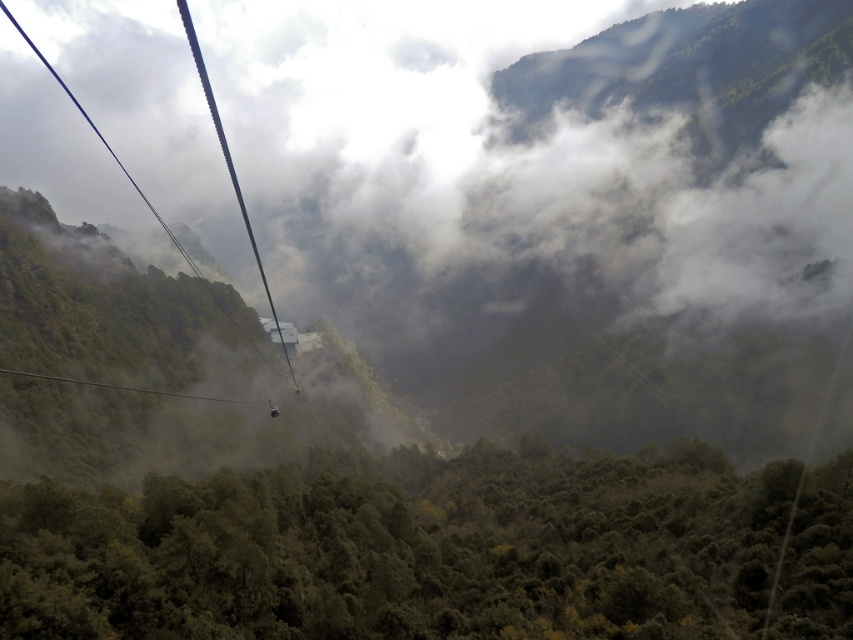
You are riding a cable car and see the white fluffy fog at center and the white plastic ski lift at left. Which object is higher in the scene?

The white fluffy fog at center is much taller than the white plastic ski lift at left, so the white fluffy fog at center is higher in the scene.

You are a passenger in the metallic cable car at center and want to take a photo of the white plastic ski lift at left. Can you see it from your current position?

The white plastic ski lift at left is located above the metallic cable car at center, so yes, you can see it from your current position in the metallic cable car at center.

You are inside a cable car moving through the valley. You notice two points marked in the scene. From your perspective inside the cable car, which point is closer to you, point (207,486) or point (276,404)?

Point (207,486) is closer because it is in front of point (276,404).